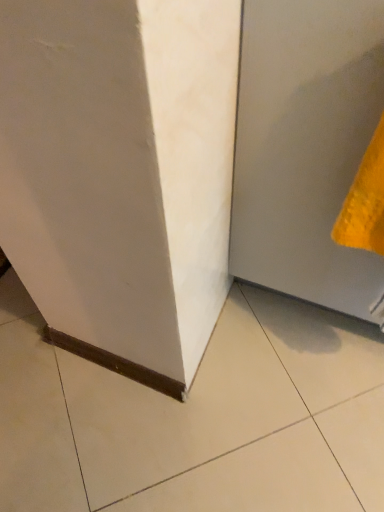
Question: Are matte gray door at lower right and yellow textured towel at right far apart?

Choices:
 (A) no
 (B) yes

Answer: (A)

Question: Does matte gray door at lower right come behind yellow textured towel at right?

Choices:
 (A) yes
 (B) no

Answer: (B)

Question: Can you confirm if matte gray door at lower right is positioned to the left of yellow textured towel at right?

Choices:
 (A) yes
 (B) no

Answer: (B)

Question: From a real-world perspective, is matte gray door at lower right over yellow textured towel at right?

Choices:
 (A) no
 (B) yes

Answer: (A)

Question: Is matte gray door at lower right taller than yellow textured towel at right?

Choices:
 (A) yes
 (B) no

Answer: (A)

Question: Can you confirm if matte gray door at lower right is shorter than yellow textured towel at right?

Choices:
 (A) yes
 (B) no

Answer: (B)

Question: Is yellow textured towel at right further to the viewer compared to matte gray door at lower right?

Choices:
 (A) yes
 (B) no

Answer: (A)

Question: Considering the relative positions of yellow textured towel at right and matte gray door at lower right in the image provided, is yellow textured towel at right to the left of matte gray door at lower right from the viewer's perspective?

Choices:
 (A) yes
 (B) no

Answer: (A)

Question: Is yellow textured towel at right with matte gray door at lower right?

Choices:
 (A) yes
 (B) no

Answer: (B)

Question: Can you confirm if yellow textured towel at right is shorter than matte gray door at lower right?

Choices:
 (A) no
 (B) yes

Answer: (B)

Question: Does yellow textured towel at right have a larger size compared to matte gray door at lower right?

Choices:
 (A) yes
 (B) no

Answer: (B)

Question: From a real-world perspective, is yellow textured towel at right physically above matte gray door at lower right?

Choices:
 (A) no
 (B) yes

Answer: (B)

Question: Is yellow textured towel at right spatially inside matte gray door at lower right, or outside of it?

Choices:
 (A) outside
 (B) inside

Answer: (B)